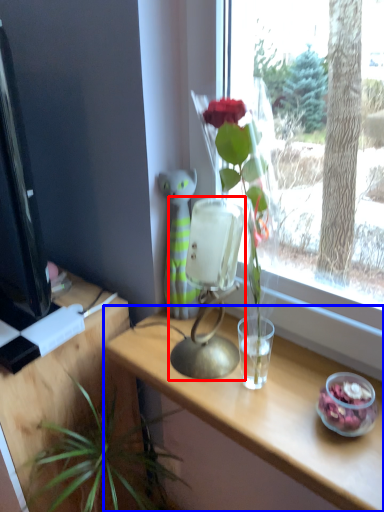
Question: Which object appears closest to the camera in this image, table lamp (highlighted by a red box) or table (highlighted by a blue box)?

Choices:
 (A) table lamp
 (B) table

Answer: (B)